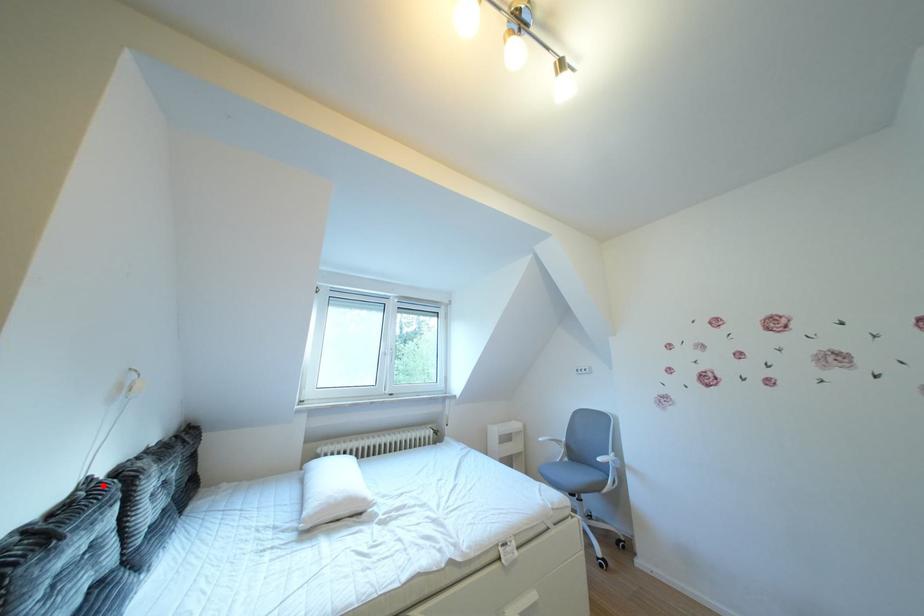
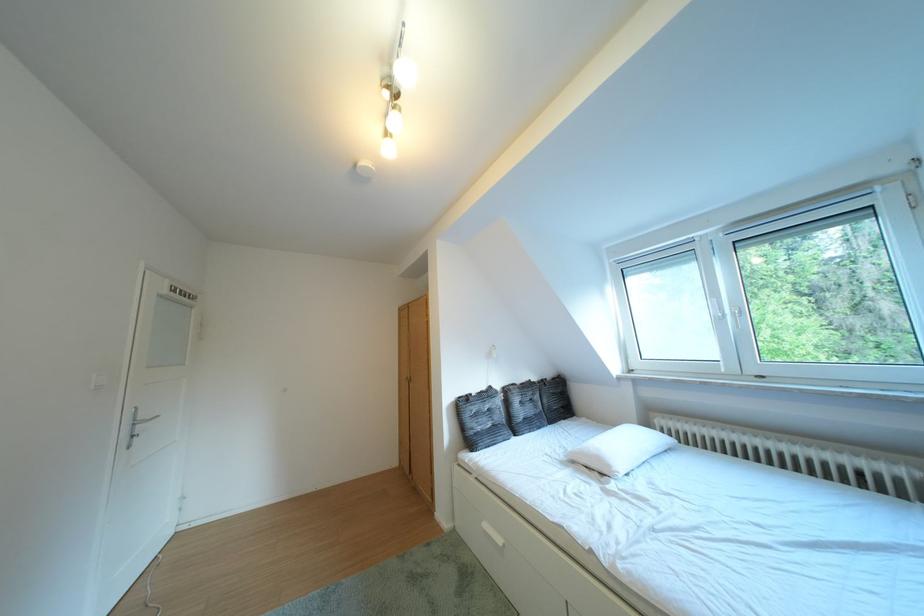
Question: I am providing you with two images of the same scene from different viewpoints. Given a red point in image1, look at the same physical point in image2. Is it:

Choices:
 (A) Closer to the viewpoint
 (B) Farther from the viewpoint

Answer: (B)